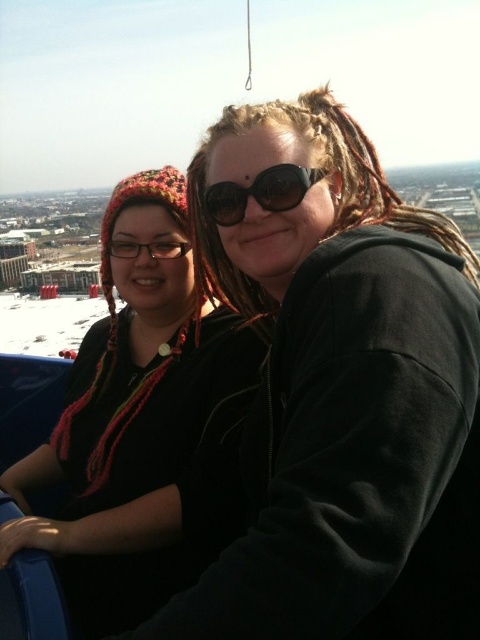
You are a photographer trying to capture a closeup shot of the knitted wool hat at left and the black matte goggles at center. Based on their positions, which object should you focus on first if you want to ensure both are in focus without adjusting the camera focus?

The knitted wool hat at left is located below the black matte goggles at center, so focusing on the black matte goggles at center first will ensure both are within the depth of field since they are stacked vertically.

Based on the photo, you are a photographer trying to capture a closeup shot of the black matte hoodie at center and the black matte goggles at center. Since you want to focus on the smaller object, which one should you adjust your camera settings for?

The black matte goggles at center are smaller than the black matte hoodie at center, so you should adjust your camera settings to focus on the black matte goggles at center.